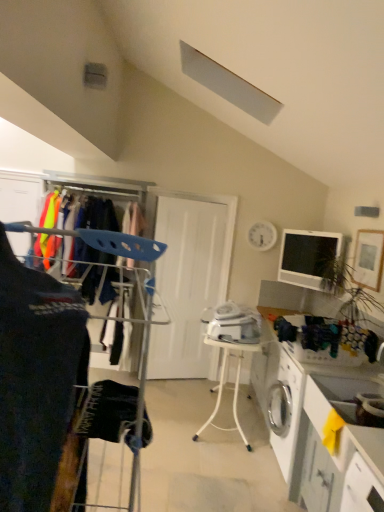
What do you see at coordinates (308, 257) in the screenshot? The height and width of the screenshot is (512, 384). I see `matte black monitor at upper right` at bounding box center [308, 257].

Where is `white glossy counter at lower right, marked as the second counter in a front-to-back arrangement`? white glossy counter at lower right, marked as the second counter in a front-to-back arrangement is located at coordinates (301, 396).

Describe the element at coordinates (235, 324) in the screenshot. The height and width of the screenshot is (512, 384). I see `white plastic iron at center` at that location.

What do you see at coordinates (225, 382) in the screenshot? I see `white plastic table at center` at bounding box center [225, 382].

The height and width of the screenshot is (512, 384). In order to click on white glossy counter at lower right, the 2th counter in the back-to-front sequence in this screenshot , I will do `click(322, 438)`.

Where is `matte black monitor at upper right`? Image resolution: width=384 pixels, height=512 pixels. matte black monitor at upper right is located at coordinates (308, 257).

Who is shorter, white glossy counter at lower right, the 2th counter in the back-to-front sequence, or white matte door at center?

With less height is white glossy counter at lower right, the 2th counter in the back-to-front sequence.

Is point (319, 423) closer to camera compared to point (164, 326)?

That is True.

Can we say white glossy counter at lower right, the 1th counter viewed from the front, lies outside white matte door at center?

Yes, white glossy counter at lower right, the 1th counter viewed from the front, is located beyond the bounds of white matte door at center.

From a real-world perspective, is white glossy counter at lower right, the 2th counter in the back-to-front sequence, positioned above or below white matte door at center?

white glossy counter at lower right, the 2th counter in the back-to-front sequence, is situated lower than white matte door at center in the real world.

From the image's perspective, which one is positioned higher, white glossy counter at lower right, marked as the second counter in a front-to-back arrangement, or dark blue fabric at left?

dark blue fabric at left is shown above in the image.

Is white glossy counter at lower right, positioned as the first counter in back-to-front order, placed right next to dark blue fabric at left?

white glossy counter at lower right, positioned as the first counter in back-to-front order, and dark blue fabric at left are not in contact.

Is white glossy counter at lower right, positioned as the first counter in back-to-front order, located outside dark blue fabric at left?

Yes, white glossy counter at lower right, positioned as the first counter in back-to-front order, is located beyond the bounds of dark blue fabric at left.

Which point is more forward, [351,396] or [51,292]?

Point [51,292]

From a real-world perspective, which is physically below, dark blue fabric at left or matte black monitor at upper right?

dark blue fabric at left is physically lower.

Locate an element on the screen. computer monitor on the right side of dark blue fabric at left is located at coordinates (308, 257).

Are dark blue fabric at left and matte black monitor at upper right located far from each other?

Yes, dark blue fabric at left and matte black monitor at upper right are quite far apart.

Between point (46, 375) and point (336, 243), which one is positioned behind?

Positioned behind is point (336, 243).

Which of these two, matte black monitor at upper right or white matte door at center, is bigger?

white matte door at center is bigger.

Image resolution: width=384 pixels, height=512 pixels. In the image, there is a white matte door at center. What are the coordinates of `computer monitor above it (from the image's perspective)` in the screenshot? It's located at (308, 257).

How distant is matte black monitor at upper right from white matte door at center?

matte black monitor at upper right and white matte door at center are 3.35 feet apart.

In the scene shown: Can you tell me how much matte black monitor at upper right and white matte door at center differ in facing direction?

The angle between the facing direction of matte black monitor at upper right and the facing direction of white matte door at center is 59.3 degrees.

From the image's perspective, between white matte door at center and dark blue fabric at left, who is located below?

white matte door at center, from the image's perspective.

Is white matte door at center oriented towards dark blue fabric at left?

Yes, white matte door at center is turned towards dark blue fabric at left.

Does white matte door at center have a greater height compared to dark blue fabric at left?

Indeed, white matte door at center has a greater height compared to dark blue fabric at left.

Can you see white matte door at center touching dark blue fabric at left?

white matte door at center and dark blue fabric at left are clearly separated.

Is white glossy counter at lower right, the 1th counter viewed from the front, a part of white glossy counter at lower right, marked as the second counter in a front-to-back arrangement?

No, white glossy counter at lower right, the 1th counter viewed from the front, is not inside white glossy counter at lower right, marked as the second counter in a front-to-back arrangement.

At what (x,y) coordinates should I click in order to perform the action: click on counter above the white glossy counter at lower right, the 1th counter viewed from the front (from the image's perspective). Please return your answer as a coordinate pair (x, y). The width and height of the screenshot is (384, 512). Looking at the image, I should click on (301, 396).

Could you tell me if white glossy counter at lower right, positioned as the first counter in back-to-front order, is facing white glossy counter at lower right, the 2th counter in the back-to-front sequence?

No, white glossy counter at lower right, positioned as the first counter in back-to-front order, does not turn towards white glossy counter at lower right, the 2th counter in the back-to-front sequence.

Can you tell me how much white glossy counter at lower right, marked as the second counter in a front-to-back arrangement, and white glossy counter at lower right, the 1th counter viewed from the front, differ in facing direction?

The angle between the facing direction of white glossy counter at lower right, marked as the second counter in a front-to-back arrangement, and the facing direction of white glossy counter at lower right, the 1th counter viewed from the front, is 0.000328 degrees.

Is white plastic iron at center positioned with its back to dark blue fabric at left?

No, white plastic iron at center is not facing the opposite direction of dark blue fabric at left.

Considering the sizes of objects white plastic iron at center and dark blue fabric at left in the image provided, who is smaller, white plastic iron at center or dark blue fabric at left?

white plastic iron at center.

Between white plastic iron at center and dark blue fabric at left, which one has larger width?

white plastic iron at center.

What are the coordinates of `door that is above the white glossy counter at lower right, the 1th counter viewed from the front (from the image's perspective)` in the screenshot? It's located at (189, 280).

Where is `clothing in front of the white glossy counter at lower right, positioned as the first counter in back-to-front order`? This screenshot has width=384, height=512. clothing in front of the white glossy counter at lower right, positioned as the first counter in back-to-front order is located at coordinates pyautogui.click(x=36, y=379).

Considering their positions, is dark blue fabric at left positioned further to white glossy counter at lower right, the 2th counter in the back-to-front sequence, than matte black monitor at upper right?

matte black monitor at upper right is further to white glossy counter at lower right, the 2th counter in the back-to-front sequence.

Considering their positions, is white matte door at center positioned further to dark blue fabric at left than matte black monitor at upper right?

The object further to dark blue fabric at left is white matte door at center.

Looking at the image, which one is located closer to white glossy counter at lower right, the 2th counter in the back-to-front sequence, white plastic table at center or white glossy counter at lower right, positioned as the first counter in back-to-front order?

Among the two, white glossy counter at lower right, positioned as the first counter in back-to-front order, is located nearer to white glossy counter at lower right, the 2th counter in the back-to-front sequence.

Based on their spatial positions, is matte black monitor at upper right or white glossy counter at lower right, the 1th counter viewed from the front, further from dark blue fabric at left?

matte black monitor at upper right is positioned further to the anchor dark blue fabric at left.

Estimate the real-world distances between objects in this image. Which object is further from white plastic table at center, dark blue fabric at left or white glossy counter at lower right, the 1th counter viewed from the front?

Based on the image, dark blue fabric at left appears to be further to white plastic table at center.

When comparing their distances from white plastic iron at center, does dark blue fabric at left or white plastic table at center seem closer?

white plastic table at center is closer to white plastic iron at center.

Which object lies nearer to the anchor point white glossy counter at lower right, the 2th counter in the back-to-front sequence, dark blue fabric at left or white matte door at center?

dark blue fabric at left lies closer to white glossy counter at lower right, the 2th counter in the back-to-front sequence, than the other object.

From the image, which object appears to be farther from white glossy counter at lower right, marked as the second counter in a front-to-back arrangement, dark blue fabric at left or white plastic table at center?

Among the two, dark blue fabric at left is located further to white glossy counter at lower right, marked as the second counter in a front-to-back arrangement.

In order to click on computer monitor between white glossy counter at lower right, positioned as the first counter in back-to-front order, and white matte door at center from front to back in this screenshot , I will do `click(308, 257)`.

The height and width of the screenshot is (512, 384). Identify the location of counter positioned between white glossy counter at lower right, the 1th counter viewed from the front, and white matte door at center from near to far. (301, 396).

You are a GUI agent. You are given a task and a screenshot of the screen. Output one action in this format:
    pyautogui.click(x=<x>, y=<y>)
    Task: Click on the computer monitor between white plastic table at center and white matte door at center in the front-back direction
    The height and width of the screenshot is (512, 384).
    Given the screenshot: What is the action you would take?
    tap(308, 257)

You are a GUI agent. You are given a task and a screenshot of the screen. Output one action in this format:
    pyautogui.click(x=<x>, y=<y>)
    Task: Click on the appliance between matte black monitor at upper right and white glossy counter at lower right, positioned as the first counter in back-to-front order, in the up-down direction
    
    Given the screenshot: What is the action you would take?
    pyautogui.click(x=235, y=324)